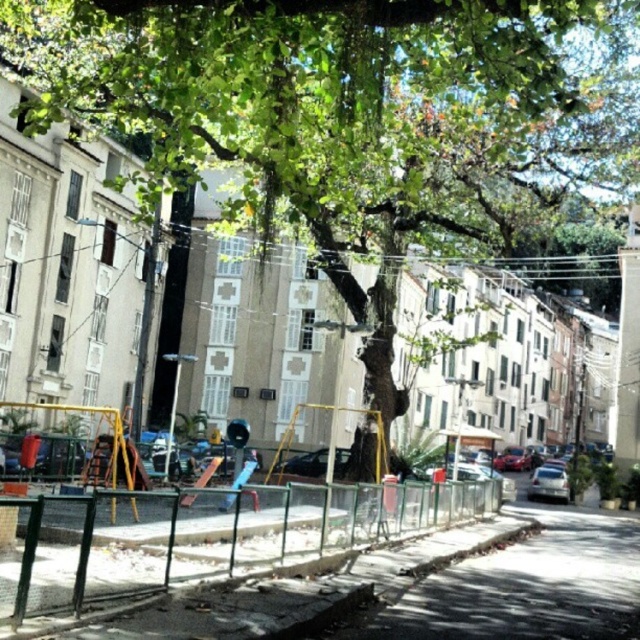
Question: Is gray concrete pavement at lower center bigger than silver metallic car at center?

Choices:
 (A) yes
 (B) no

Answer: (A)

Question: Which point appears farthest from the camera in this image?

Choices:
 (A) [x=573, y=524]
 (B) [x=548, y=499]
 (C) [x=60, y=504]

Answer: (B)

Question: Does gray concrete pavement at lower center appear on the right side of silver metallic car at center?

Choices:
 (A) no
 (B) yes

Answer: (A)

Question: Can you confirm if gray concrete pavement at lower center is smaller than metallic silver car at center?

Choices:
 (A) yes
 (B) no

Answer: (B)

Question: Which point is farther to the camera?

Choices:
 (A) (317, 449)
 (B) (232, 529)
 (C) (548, 467)

Answer: (A)

Question: Based on their relative distances, which object is farther from the metallic silver car at center?

Choices:
 (A) silver metallic car at center
 (B) gray concrete pavement at lower center
 (C) green metal fence at center

Answer: (A)